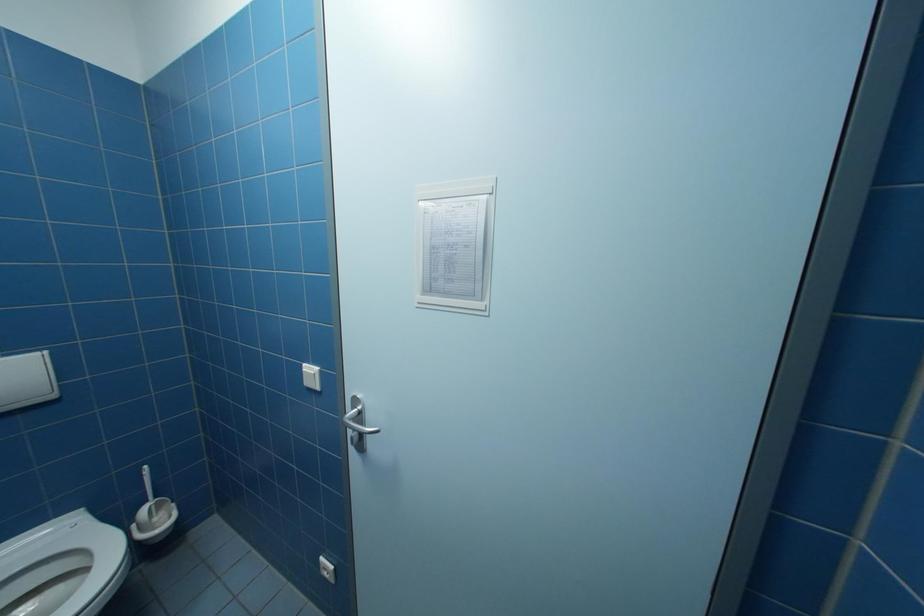
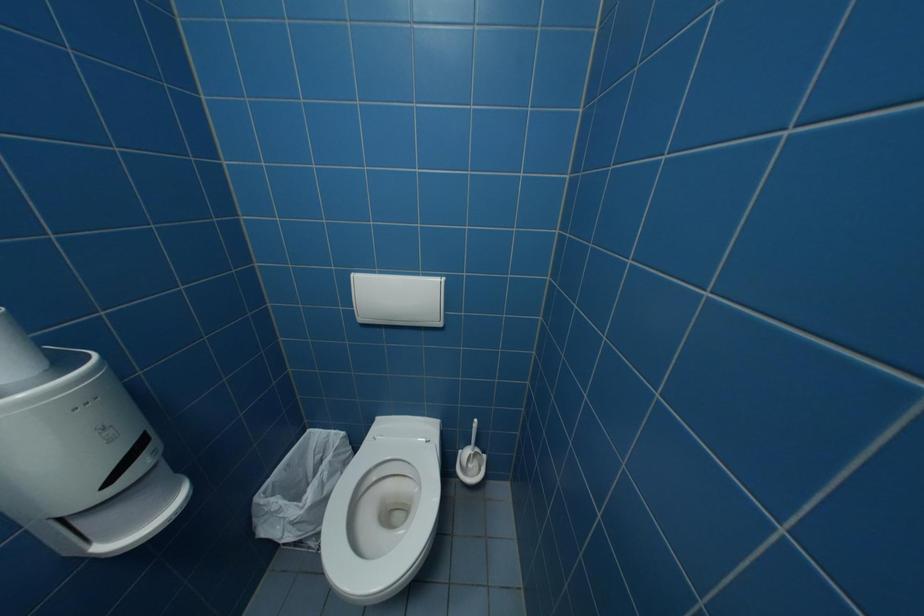
First-person continuous shooting, in which direction is the camera rotating?

The camera's rotation is toward left-down.